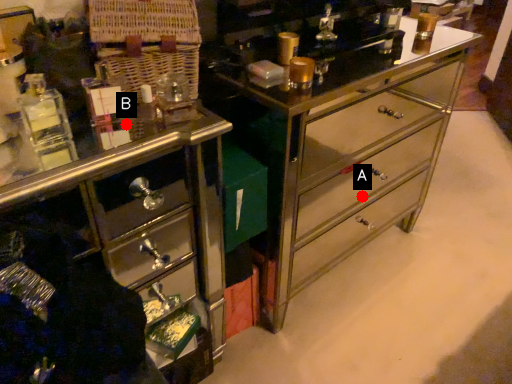
Question: Two points are circled on the image, labeled by A and B beside each circle. Among these points, which one is farthest from the camera?

Choices:
 (A) A is further
 (B) B is further

Answer: (A)